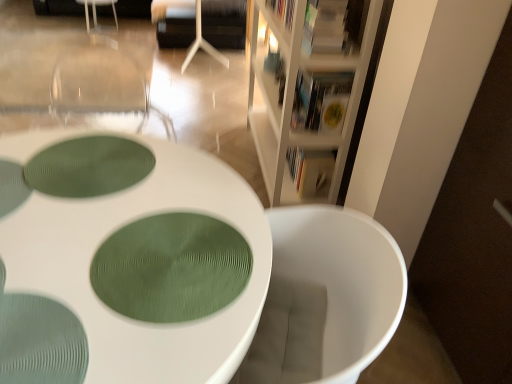
Where is `vacant area that lies in front of green textured placemat at center, placed as the 2th oval when sorted from bottom to top`? The height and width of the screenshot is (384, 512). vacant area that lies in front of green textured placemat at center, placed as the 2th oval when sorted from bottom to top is located at coordinates (76, 244).